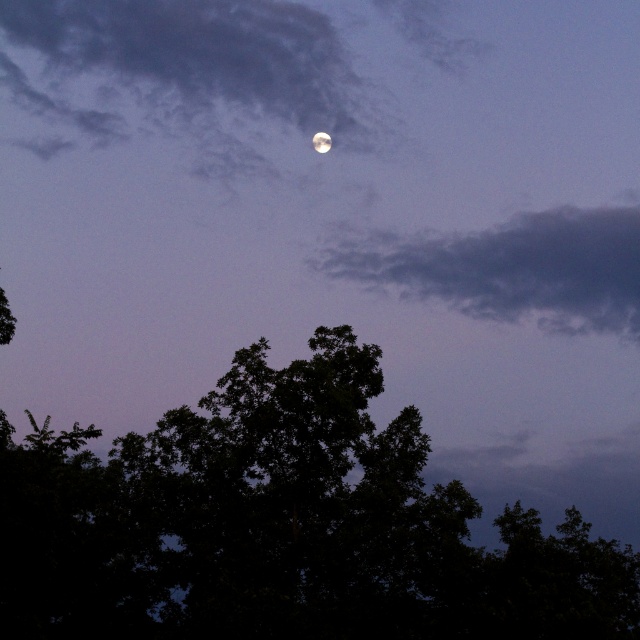
Question: Which point appears closest to the camera in this image?

Choices:
 (A) (314, 20)
 (B) (337, 250)

Answer: (B)

Question: Which of the following is the farthest from the observer?

Choices:
 (A) cloudy sky at upper center
 (B) gray matte cloud at upper center

Answer: (A)

Question: Which point appears closest to the camera in this image?

Choices:
 (A) (484, 252)
 (B) (321, 150)
 (C) (323, 65)
 (D) (531, 593)

Answer: (D)

Question: Is green leafy tree at center closer to the viewer compared to cloudy sky at upper center?

Choices:
 (A) no
 (B) yes

Answer: (B)

Question: Is cloudy sky at upper center positioned at the back of smooth silver moon at upper center?

Choices:
 (A) yes
 (B) no

Answer: (A)

Question: Is cloudy sky at upper center bigger than smooth silver moon at upper center?

Choices:
 (A) no
 (B) yes

Answer: (B)